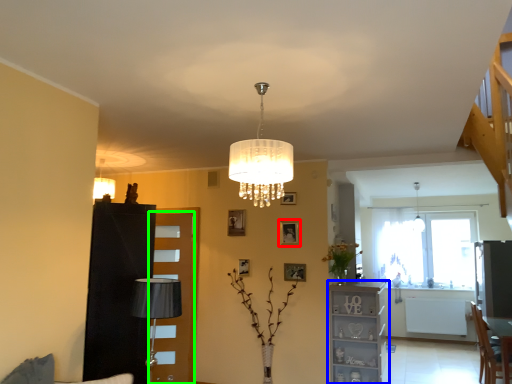
Question: Estimate the real-world distances between objects in this image. Which object is closer to picture frame (highlighted by a red box), furniture (highlighted by a blue box) or glass door (highlighted by a green box)?

Choices:
 (A) furniture
 (B) glass door

Answer: (A)